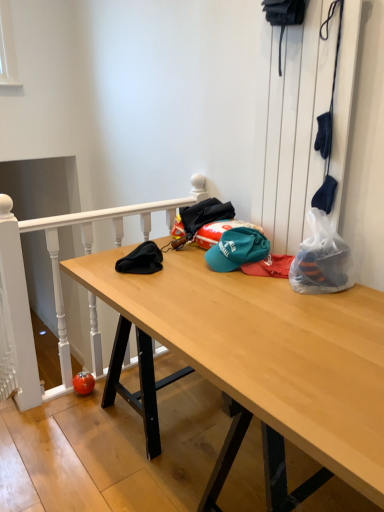
Question: From the image's perspective, is light wood desk at center located above or below translucent plastic bag at right?

Choices:
 (A) above
 (B) below

Answer: (B)

Question: Considering the relative positions of light wood desk at center and translucent plastic bag at right in the image provided, is light wood desk at center to the left or to the right of translucent plastic bag at right?

Choices:
 (A) right
 (B) left

Answer: (B)

Question: Estimate the real-world distances between objects in this image. Which object is closer to the translucent plastic bag at right?

Choices:
 (A) teal fabric cap at center
 (B) white wood rail at upper left
 (C) light wood desk at center

Answer: (A)

Question: Based on their relative distances, which object is farther from the teal fabric cap at center?

Choices:
 (A) translucent plastic bag at right
 (B) white wood rail at upper left
 (C) light wood desk at center

Answer: (B)